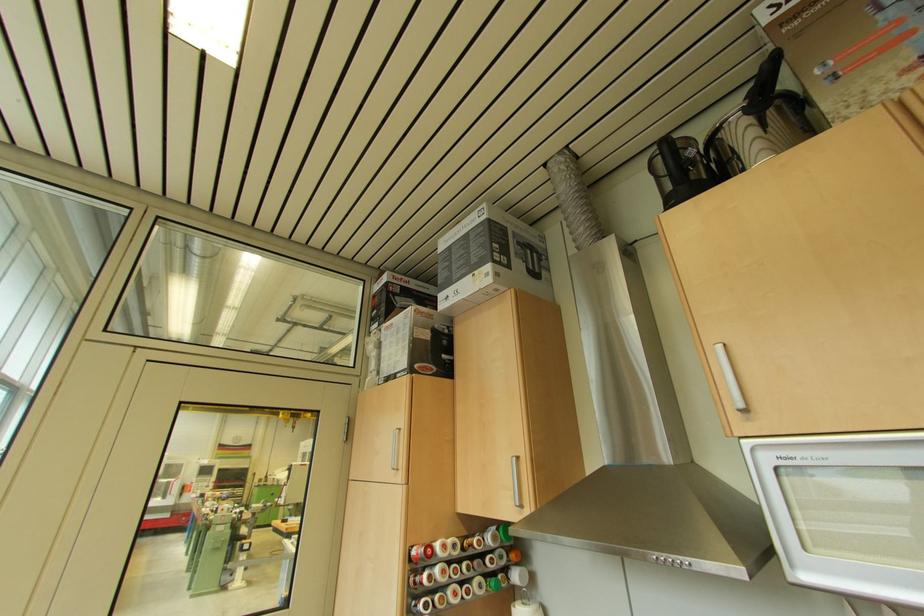
You are a GUI agent. You are given a task and a screenshot of the screen. Output one action in this format:
    pyautogui.click(x=<x>, y=<y>)
    Task: Click on the green spice container
    The image size is (924, 616).
    Given the screenshot: What is the action you would take?
    pyautogui.click(x=211, y=556)